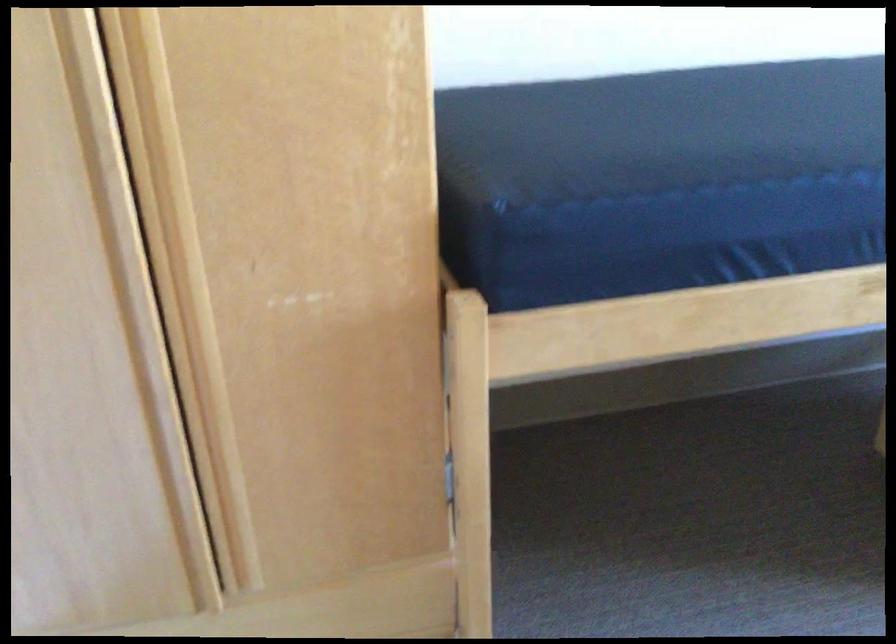
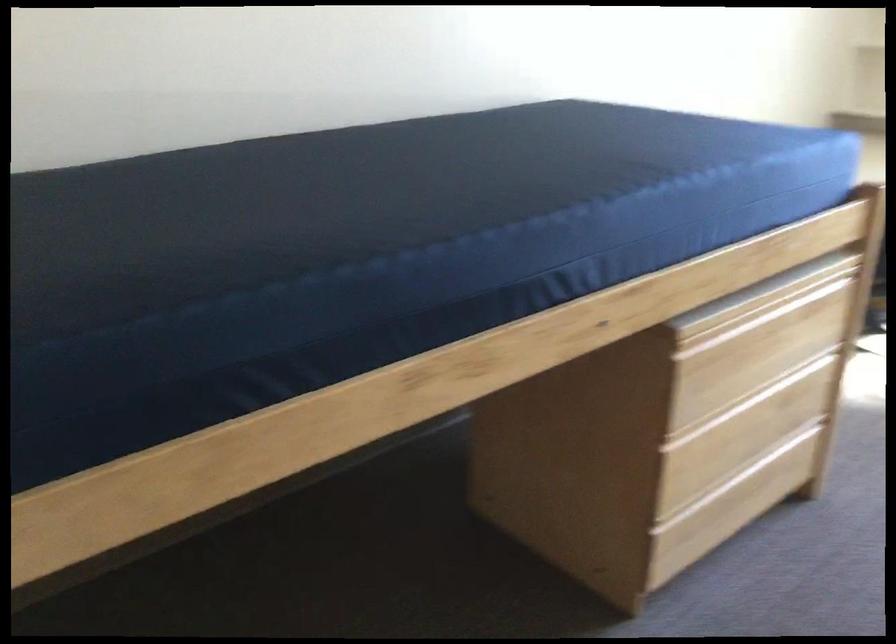
Question: How did the camera likely rotate?

Choices:
 (A) Left
 (B) Right
 (C) Up
 (D) Down

Answer: (B)